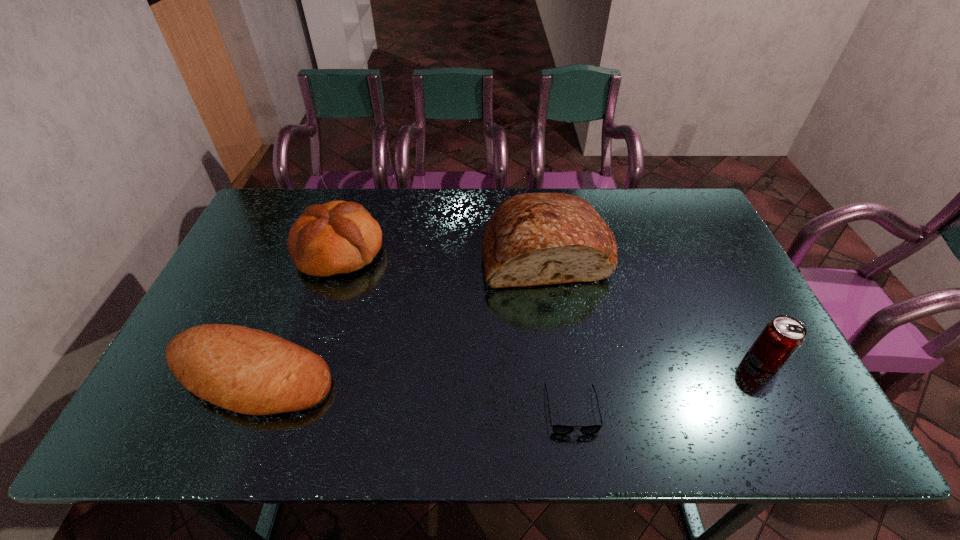
In the image, there is a desktop. Where is `vacant space at the far left corner`? The image size is (960, 540). vacant space at the far left corner is located at coordinates (281, 207).

Find the location of `empty space between the pop soda and the spectacles`. empty space between the pop soda and the spectacles is located at coordinates (668, 384).

Locate an element on the screen. The image size is (960, 540). vacant area that lies between the shortest object and the fourth tallest object is located at coordinates (412, 393).

The height and width of the screenshot is (540, 960). I want to click on free space between the second tallest bread and the fourth tallest object, so click(296, 313).

In order to click on unoccupied position between the rightmost object and the tallest bread in this screenshot , I will do `click(655, 306)`.

At what (x,y) coordinates should I click in order to perform the action: click on empty space between the second tallest bread and the rightmost object. Please return your answer as a coordinate pair (x, y). The width and height of the screenshot is (960, 540). Looking at the image, I should click on (552, 305).

Where is `free spot between the rightmost object and the nearest bread`? free spot between the rightmost object and the nearest bread is located at coordinates (508, 368).

The width and height of the screenshot is (960, 540). I want to click on free space between the shortest object and the tallest object, so click(x=559, y=330).

The width and height of the screenshot is (960, 540). In order to click on free space between the fourth tallest object and the rightmost object in this screenshot , I will do [x=508, y=368].

Find the location of a particular element. This screenshot has width=960, height=540. vacant area that lies between the pop soda and the second tallest bread is located at coordinates (552, 305).